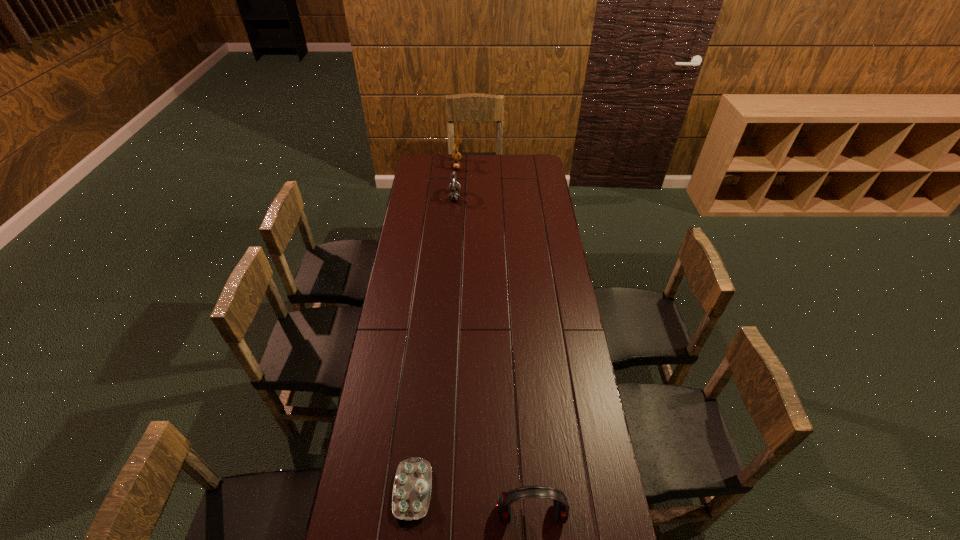
At what (x,y) coordinates should I click in order to perform the action: click on object present at the right edge. Please return your answer as a coordinate pair (x, y). Looking at the image, I should click on (561, 506).

The height and width of the screenshot is (540, 960). In the image, there is a desktop. Identify the location of free space at the left edge. (390, 418).

The image size is (960, 540). In the image, there is a desktop. Identify the location of vacant space at the right edge. (538, 211).

Find the location of a particular element. The width and height of the screenshot is (960, 540). vacant space at the far left corner of the desktop is located at coordinates (436, 157).

In the image, there is a desktop. Where is `vacant space at the far right corner`? vacant space at the far right corner is located at coordinates (529, 172).

This screenshot has width=960, height=540. Identify the location of vacant space in between the nearest earphone and the chinaware. (472, 502).

Locate an element on the screen. free spot between the rightmost object and the farthest object is located at coordinates (494, 339).

Locate an element on the screen. This screenshot has height=540, width=960. vacant space that's between the farthest earphone and the chinaware is located at coordinates pyautogui.click(x=435, y=328).

Identify the location of vacant area that lies between the rightmost earphone and the farthest earphone. (494, 339).

Where is `free space between the rightmost object and the second farthest object`? The width and height of the screenshot is (960, 540). free space between the rightmost object and the second farthest object is located at coordinates (493, 355).